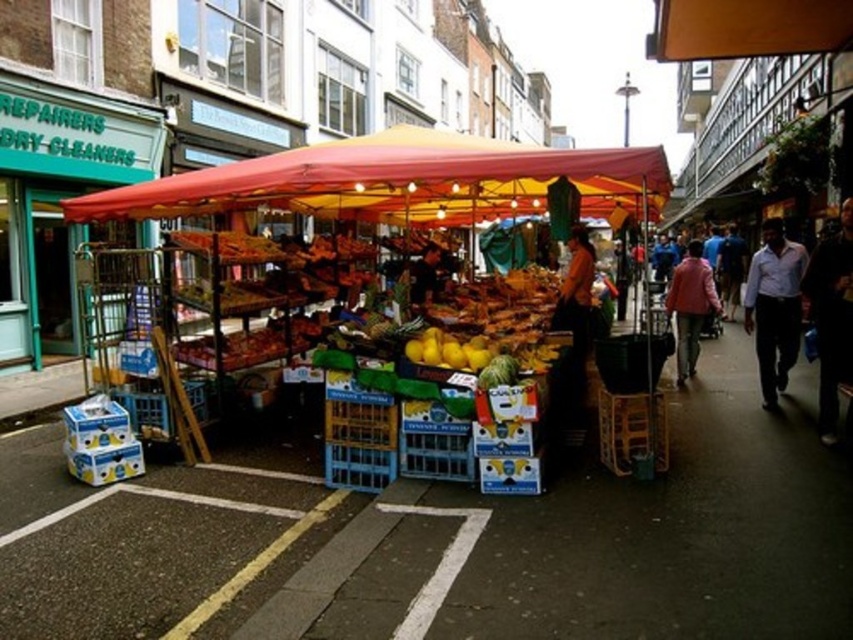
You are a delivery person who needs to place a package between the matte plastic fruit stand at center and the dark blue jeans at lower right. The package requires a space of 15 feet. Can you fit it there?

The distance between the matte plastic fruit stand at center and the dark blue jeans at lower right is 17.23 feet, so yes, the package requiring 15 feet of space can fit in between them.

You are a customer at the market and want to buy some fruits. You see the matte plastic fruit stand at center and the dark blue jeans at lower right. Which item is located to the left of the other?

The matte plastic fruit stand at center is positioned on the left side of dark blue jeans at lower right, so the matte plastic fruit stand at center is to the left of the dark blue jeans at lower right.